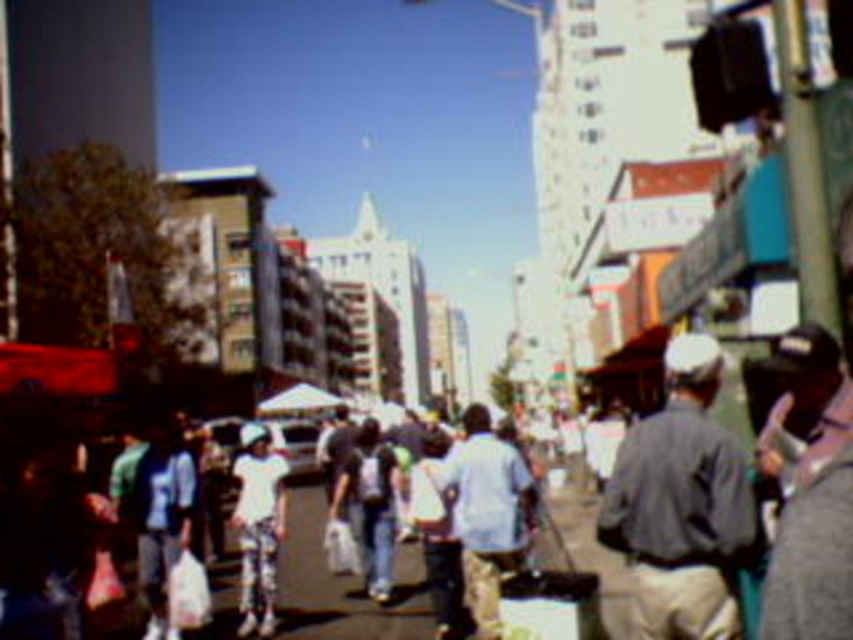
Question: Which of the following is the farthest from the observer?

Choices:
 (A) gray fabric shirt at center
 (B) white matte pants at center

Answer: (B)

Question: Is gray fabric shirt at center positioned at the back of white matte pants at center?

Choices:
 (A) yes
 (B) no

Answer: (B)

Question: Which of the following is the farthest from the observer?

Choices:
 (A) gray fabric shirt at center
 (B) white matte pants at center

Answer: (B)

Question: Can you confirm if gray fabric shirt at center is thinner than white matte pants at center?

Choices:
 (A) no
 (B) yes

Answer: (B)

Question: Is gray fabric shirt at center thinner than white matte pants at center?

Choices:
 (A) no
 (B) yes

Answer: (B)